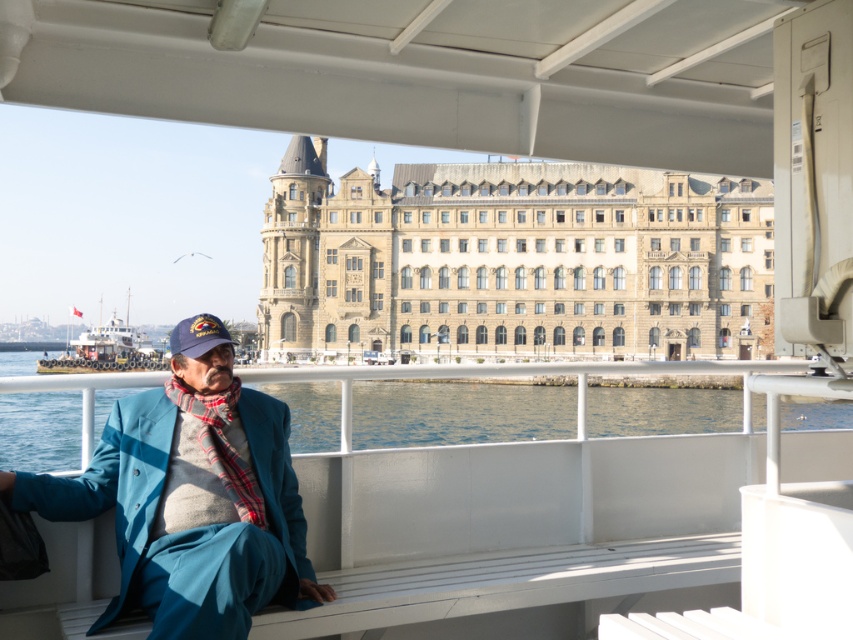
You are standing on the ferry and see the clear blue water at lower left and the plaid wool scarf at center. Which object is located to the right of the other?

The clear blue water at lower left is positioned on the right side of plaid wool scarf at center, so the clear blue water at lower left is to the right of the plaid wool scarf at center.

You are standing on the ferry and want to take a photo of the point at coordinates (22, 465). The camera you are using has a maximum zoom range of 100 meters. Can you capture the point in focus without moving closer?

The point at coordinates (22, 465) is 110.80 meters away from the camera. Since the camera has a maximum zoom range of 100 meters, it cannot capture the point in focus without moving closer.

You are standing on the ferry and want to look at the clear blue water at lower left and the white plastic boat at lower left. Which one is positioned more to the left side?

The white plastic boat at lower left is more to the left than the clear blue water at lower left.